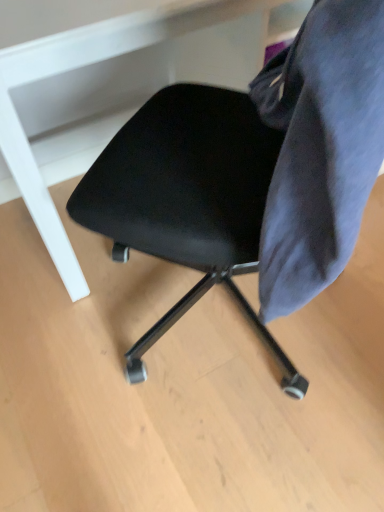
What do you see at coordinates (194, 189) in the screenshot?
I see `black leather chair at center` at bounding box center [194, 189].

Image resolution: width=384 pixels, height=512 pixels. Describe the element at coordinates (320, 148) in the screenshot. I see `velvet dark blue chair at right` at that location.

Where is `black leather chair at center`? black leather chair at center is located at coordinates (194, 189).

From the image's perspective, is black matte chair at center under black leather chair at center?

No, from the image's perspective, black matte chair at center is not beneath black leather chair at center.

Do you think black matte chair at center is within black leather chair at center, or outside of it?

black matte chair at center cannot be found inside black leather chair at center.

Could you tell me if black matte chair at center is turned towards black leather chair at center?

Yes, black matte chair at center faces towards black leather chair at center.

Who is shorter, black matte chair at center or black leather chair at center?

Standing shorter between the two is black matte chair at center.

Is black leather chair at center facing towards black matte chair at center?

Yes, black leather chair at center faces towards black matte chair at center.

Considering the sizes of objects black leather chair at center and black matte chair at center in the image provided, who is taller, black leather chair at center or black matte chair at center?

With more height is black leather chair at center.

Does point (187, 179) come farther from viewer compared to point (37, 184)?

No.

Can you confirm if black leather chair at center is thinner than velvet dark blue chair at right?

No, black leather chair at center is not thinner than velvet dark blue chair at right.

From the image's perspective, is black leather chair at center under velvet dark blue chair at right?

Yes, from the image's perspective, black leather chair at center is beneath velvet dark blue chair at right.

Is black leather chair at center facing away from velvet dark blue chair at right?

Yes, black leather chair at center's orientation is away from velvet dark blue chair at right.

Can you confirm if black leather chair at center is smaller than velvet dark blue chair at right?

No, black leather chair at center is not smaller than velvet dark blue chair at right.

From the image's perspective, would you say velvet dark blue chair at right is shown under black leather chair at center?

Incorrect, from the image's perspective, velvet dark blue chair at right is higher than black leather chair at center.

In the scene shown: Which point is more distant from viewer, (333, 228) or (187, 133)?

The point (187, 133) is more distant.

Is black leather chair at center at the back of velvet dark blue chair at right?

Correct, velvet dark blue chair at right is looking away from black leather chair at center.

From a real-world perspective, is velvet dark blue chair at right physically above black matte chair at center?

Indeed, from a real-world perspective, velvet dark blue chair at right stands above black matte chair at center.

Locate an element on the screen. This screenshot has width=384, height=512. vanity behind the velvet dark blue chair at right is located at coordinates (80, 97).

From the image's perspective, does velvet dark blue chair at right appear higher than black matte chair at center?

No, from the image's perspective, velvet dark blue chair at right is not on top of black matte chair at center.

Considering the sizes of objects black matte chair at center and velvet dark blue chair at right in the image provided, who is wider, black matte chair at center or velvet dark blue chair at right?

black matte chair at center.

Is black matte chair at center facing away from velvet dark blue chair at right?

No, black matte chair at center is not facing the opposite direction of velvet dark blue chair at right.

Does point (173, 18) lie in front of point (328, 177)?

No, (173, 18) is behind (328, 177).

From a real-world perspective, which is physically below, black matte chair at center or velvet dark blue chair at right?

In real-world perspective, black matte chair at center is lower.

Find the location of `vanity above the black leather chair at center (from the image's perspective)`. vanity above the black leather chair at center (from the image's perspective) is located at coordinates (80, 97).

Locate an element on the screen. This screenshot has width=384, height=512. chair below the black matte chair at center (from the image's perspective) is located at coordinates (194, 189).

Considering their positions, is velvet dark blue chair at right positioned closer to black matte chair at center than black leather chair at center?

Among the two, black leather chair at center is located nearer to black matte chair at center.

Consider the image. Considering their positions, is black matte chair at center positioned closer to velvet dark blue chair at right than black leather chair at center?

Based on the image, black leather chair at center appears to be nearer to velvet dark blue chair at right.

Considering their positions, is black leather chair at center positioned closer to black matte chair at center than velvet dark blue chair at right?

Among the two, black leather chair at center is located nearer to black matte chair at center.

Looking at this image, when comparing their distances from black leather chair at center, does black matte chair at center or velvet dark blue chair at right seem further?

The object further to black leather chair at center is black matte chair at center.

When comparing their distances from black leather chair at center, does velvet dark blue chair at right or black matte chair at center seem further?

Based on the image, black matte chair at center appears to be further to black leather chair at center.

Looking at the image, which one is located further to velvet dark blue chair at right, black leather chair at center or black matte chair at center?

black matte chair at center.

Identify the location of fabric positioned between black leather chair at center and black matte chair at center from near to far. (320, 148).